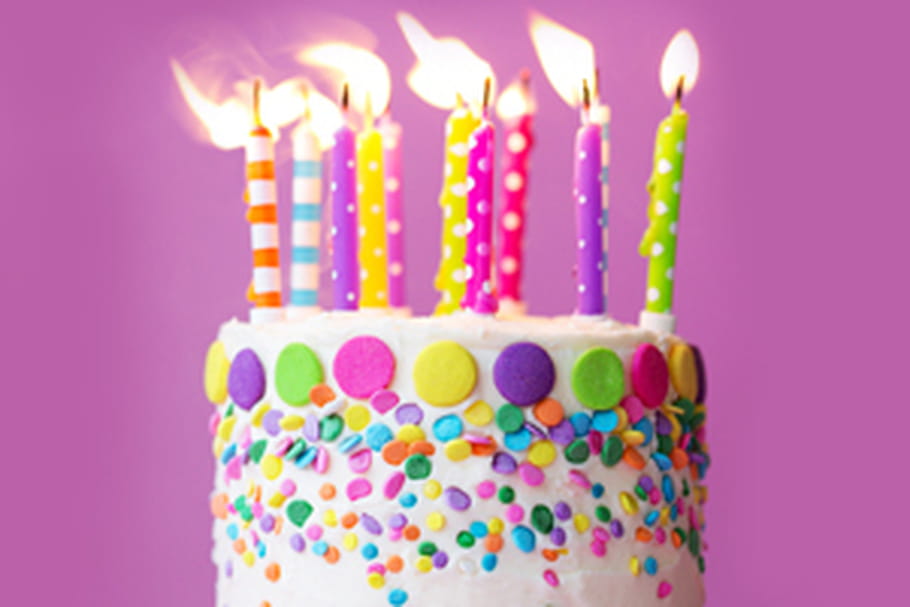
The height and width of the screenshot is (607, 910). I want to click on candle flame, so click(x=686, y=83), click(x=569, y=62), click(x=518, y=90), click(x=464, y=63), click(x=438, y=78), click(x=379, y=83), click(x=382, y=104), click(x=346, y=87), click(x=298, y=106), click(x=259, y=99).